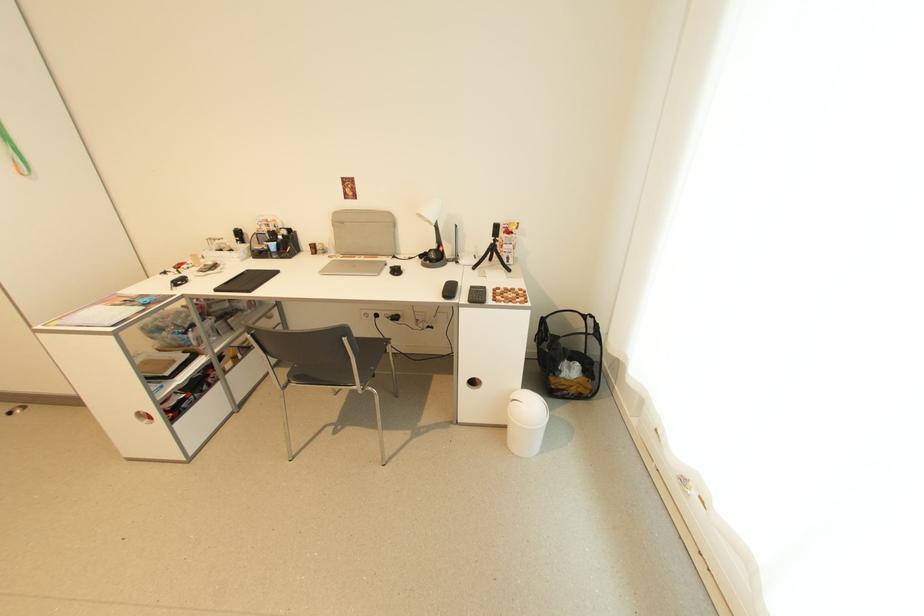
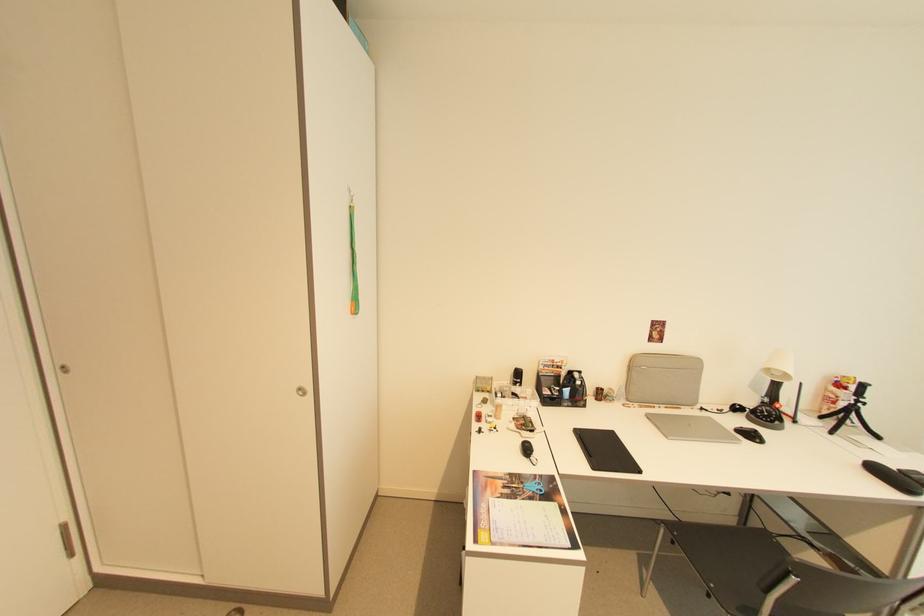
The point at (497,244) is marked in the first image. Where is the corresponding point in the second image?

(857, 405)